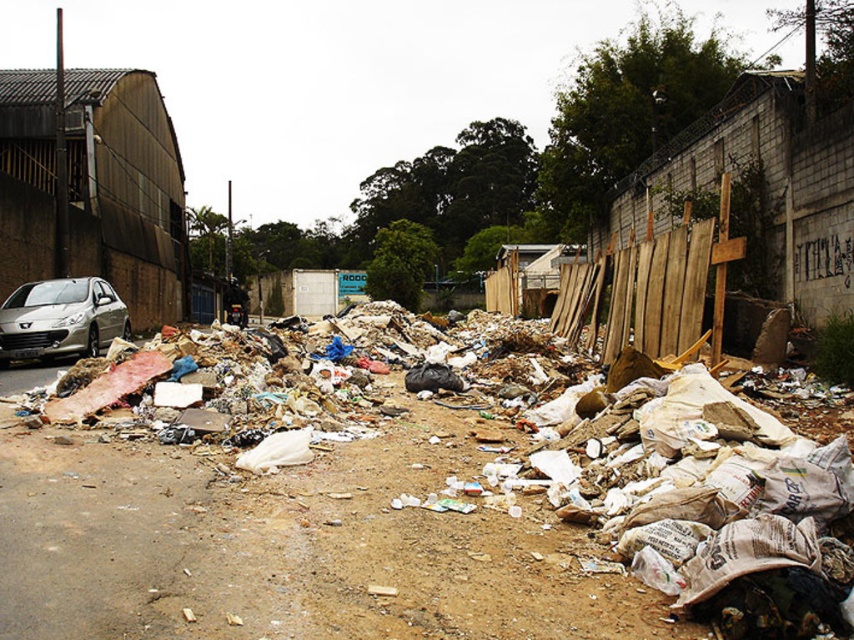
Question: Can you confirm if brown paper bags at center is thinner than satin silver car at left?

Choices:
 (A) yes
 (B) no

Answer: (B)

Question: Which of the following is the farthest from the observer?

Choices:
 (A) (402, 577)
 (B) (57, 355)

Answer: (B)

Question: Which point is closer to the camera?

Choices:
 (A) satin silver car at left
 (B) brown paper bags at center

Answer: (B)

Question: Is brown paper bags at center smaller than satin silver car at left?

Choices:
 (A) no
 (B) yes

Answer: (A)

Question: Is brown paper bags at center wider than satin silver car at left?

Choices:
 (A) yes
 (B) no

Answer: (A)

Question: Which of the following is the closest to the observer?

Choices:
 (A) tap(107, 332)
 (B) tap(21, 621)

Answer: (B)